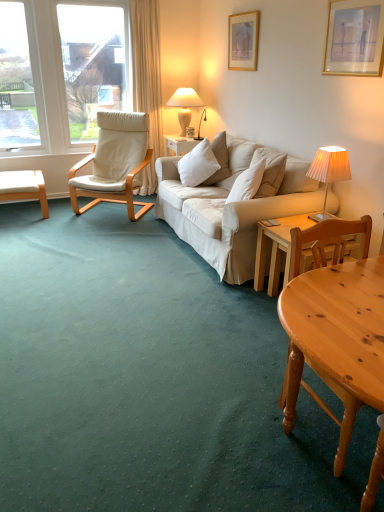
Question: Is wooden picture frame at upper center, positioned as the second picture frame in right-to-left order, further to the viewer compared to white leather chair at left?

Choices:
 (A) yes
 (B) no

Answer: (B)

Question: Is wooden picture frame at upper center, positioned as the first picture frame in left-to-right order, touching white leather chair at left?

Choices:
 (A) no
 (B) yes

Answer: (A)

Question: Is wooden picture frame at upper center, positioned as the second picture frame in right-to-left order, positioned in front of white leather chair at left?

Choices:
 (A) yes
 (B) no

Answer: (A)

Question: From the image's perspective, is wooden picture frame at upper center, positioned as the first picture frame in left-to-right order, beneath white leather chair at left?

Choices:
 (A) yes
 (B) no

Answer: (B)

Question: In terms of size, does pleated fabric lampshade at right, which is counted as the first lamp, starting from the bottom, appear bigger or smaller than white soft cushion at center?

Choices:
 (A) big
 (B) small

Answer: (B)

Question: Is pleated fabric lampshade at right, positioned as the first lamp in right-to-left order, to the left or to the right of white soft cushion at center in the image?

Choices:
 (A) left
 (B) right

Answer: (B)

Question: Relative to white soft cushion at center, is pleated fabric lampshade at right, placed as the 2th lamp when sorted from top to bottom, in front or behind?

Choices:
 (A) behind
 (B) front

Answer: (B)

Question: From a real-world perspective, is pleated fabric lampshade at right, positioned as the first lamp in right-to-left order, physically located above or below white soft cushion at center?

Choices:
 (A) below
 (B) above

Answer: (B)

Question: Is point (183, 158) positioned closer to the camera than point (377, 50)?

Choices:
 (A) closer
 (B) farther

Answer: (B)

Question: Considering the positions of white soft cushion at center and wooden framed artwork at upper right, the 2th picture frame from the back, in the image, is white soft cushion at center taller or shorter than wooden framed artwork at upper right, the 2th picture frame from the back,?

Choices:
 (A) short
 (B) tall

Answer: (A)

Question: Considering their positions, is white soft cushion at center located in front of or behind wooden framed artwork at upper right, the 2th picture frame from the back?

Choices:
 (A) behind
 (B) front

Answer: (A)

Question: From a real-world perspective, is white soft cushion at center positioned above or below wooden framed artwork at upper right, which is the second picture frame from top to bottom?

Choices:
 (A) above
 (B) below

Answer: (B)

Question: Do you think white soft cushion at center is within white glossy lamp at upper center, the second lamp ordered from the bottom, or outside of it?

Choices:
 (A) inside
 (B) outside

Answer: (B)

Question: From a real-world perspective, is white soft cushion at center physically located above or below white glossy lamp at upper center, marked as the 1th lamp in a left-to-right arrangement?

Choices:
 (A) below
 (B) above

Answer: (A)